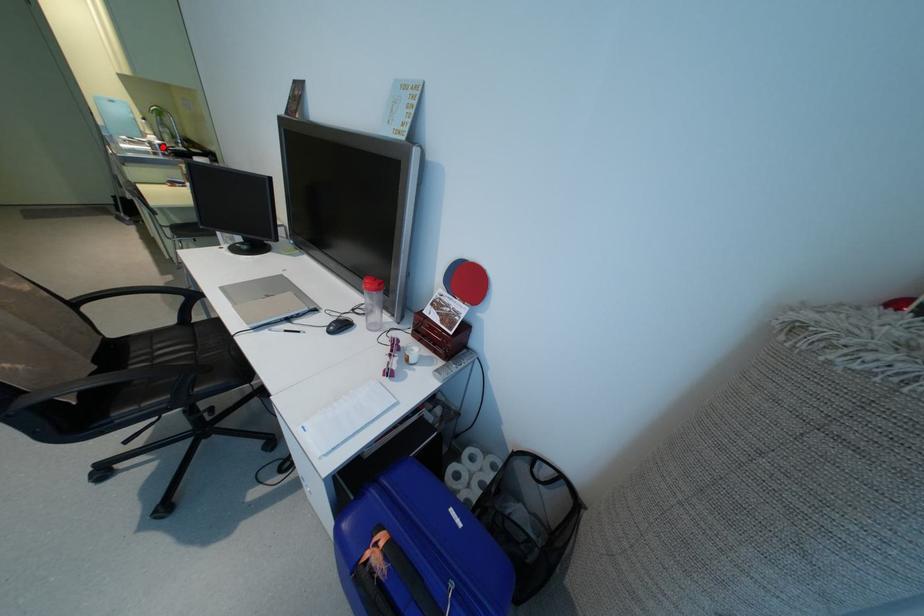
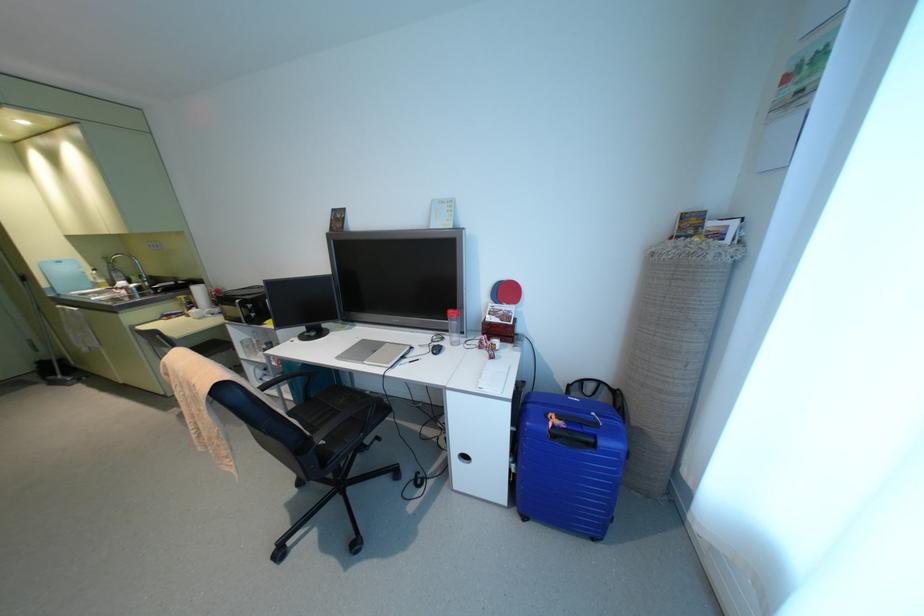
Find the pixel in the second image that matches the highlighted location in the first image.

(139, 288)